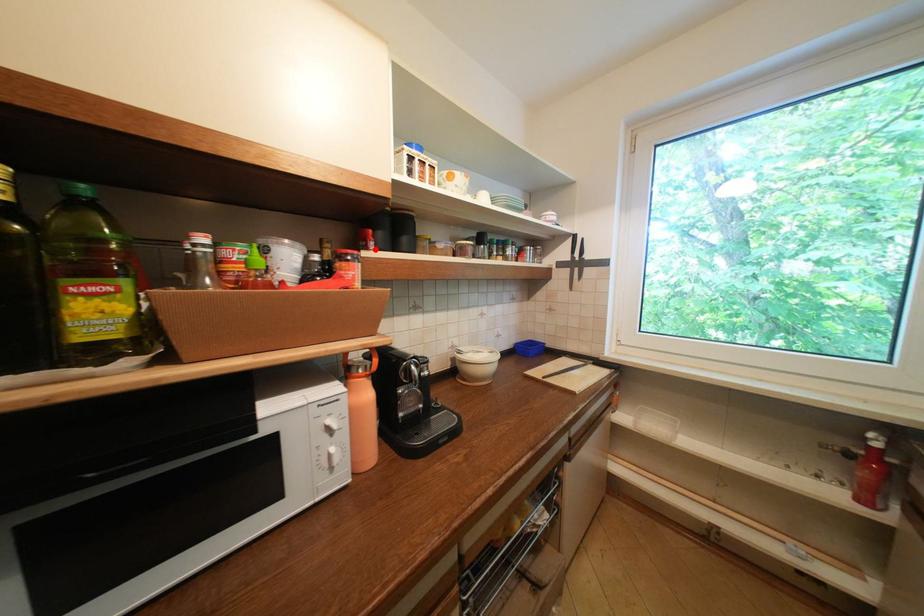
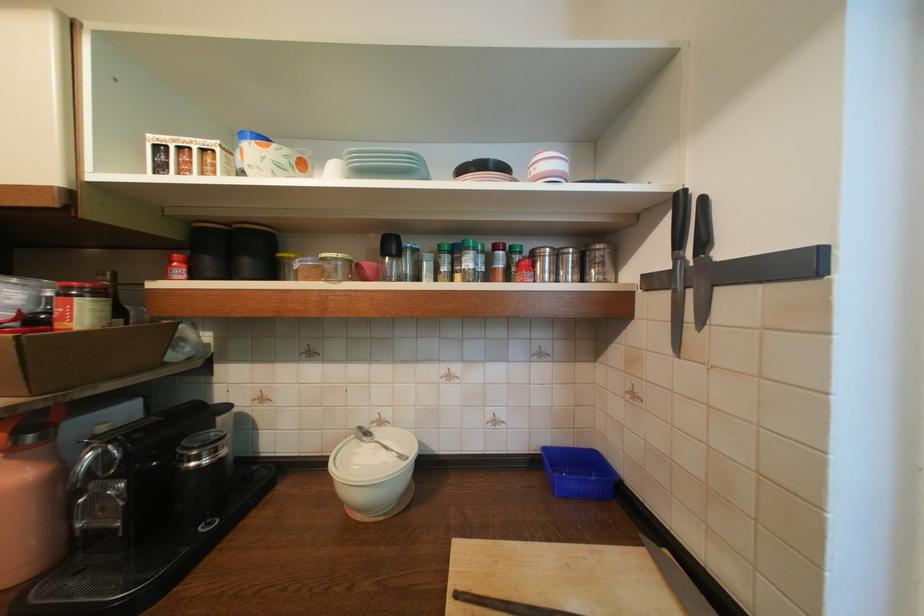
The point at the highlighted location is marked in the first image. Where is the corresponding point in the second image?

(174, 278)